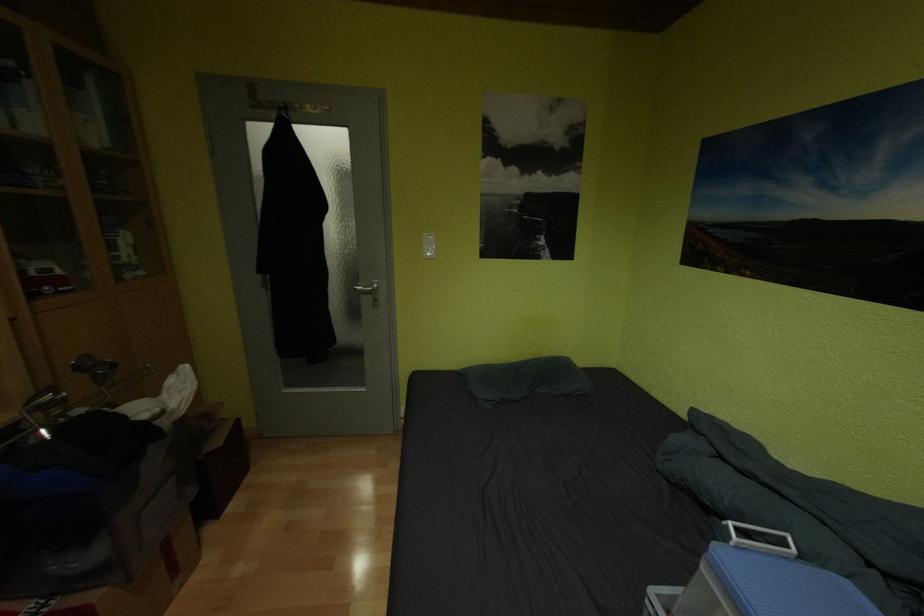
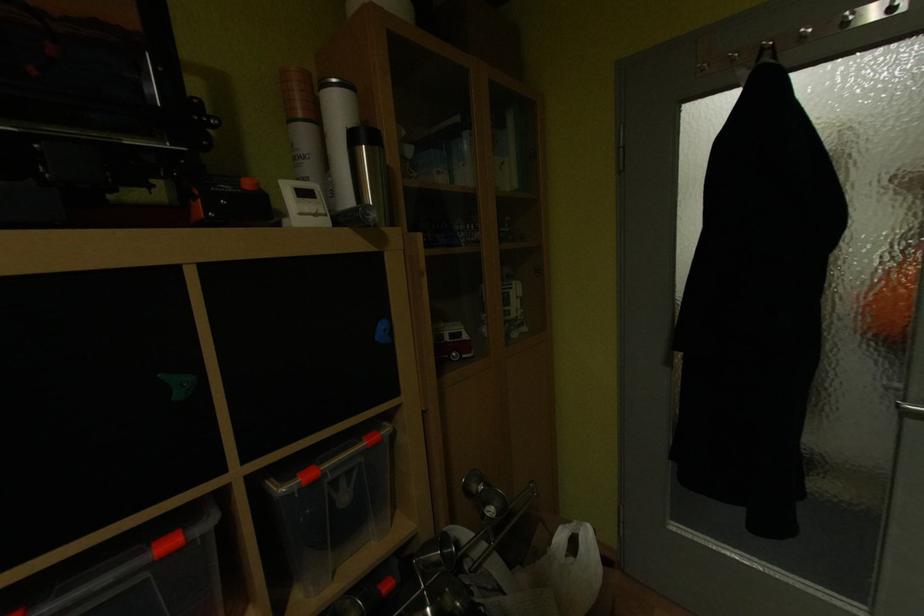
Question: The camera is either moving clockwise (left) or counter-clockwise (right) around the object. The first image is from the beginning of the video and the second image is from the end. Is the camera moving left or right when shooting the video?

Choices:
 (A) Left
 (B) Right

Answer: (B)